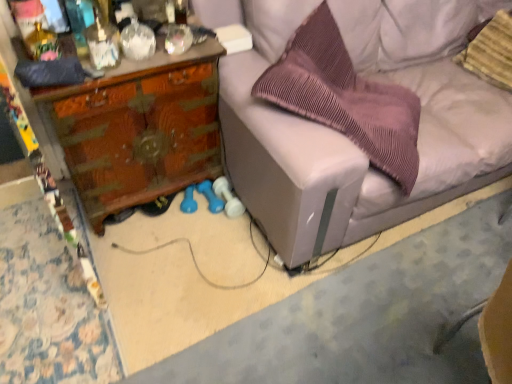
I want to click on vacant area that is in front of wooden desk at left, so click(x=134, y=272).